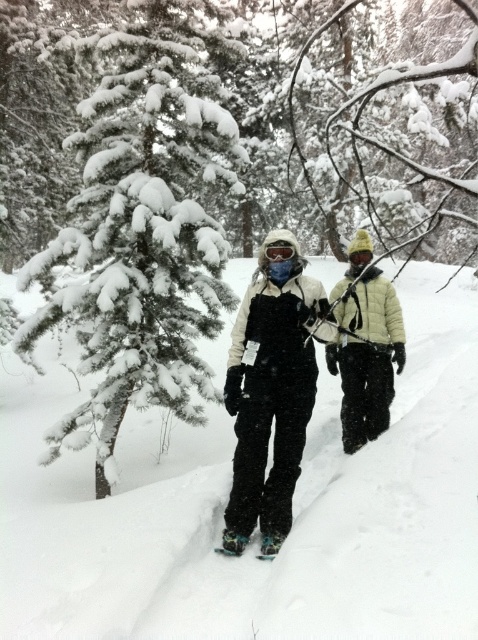
Who is taller, light yellow down jacket at center or blue rubber snowshoe at lower center?

Standing taller between the two is light yellow down jacket at center.

How distant is light yellow down jacket at center from blue rubber snowshoe at lower center?

light yellow down jacket at center is 2.17 meters away from blue rubber snowshoe at lower center.

Between point (362, 433) and point (269, 536), which one is positioned in front?

Point (269, 536)

The width and height of the screenshot is (478, 640). In order to click on light yellow down jacket at center in this screenshot , I will do `click(367, 356)`.

Is snow-covered pine tree at left to the right of blue rubber snowshoe at lower center from the viewer's perspective?

No, snow-covered pine tree at left is not to the right of blue rubber snowshoe at lower center.

Between snow-covered pine tree at left and blue rubber snowshoe at lower center, which one appears on the right side from the viewer's perspective?

blue rubber snowshoe at lower center is more to the right.

Who is more forward, (x=0, y=182) or (x=271, y=536)?

Point (x=271, y=536) is in front.

Locate an element on the screen. The height and width of the screenshot is (640, 478). snow-covered pine tree at left is located at coordinates (256, 122).

Is blue rubber snowshoe at lower center above green rubber snowshoe at center?

Indeed, blue rubber snowshoe at lower center is positioned over green rubber snowshoe at center.

Who is positioned more to the right, blue rubber snowshoe at lower center or green rubber snowshoe at center?

green rubber snowshoe at center is more to the right.

Between point (279, 538) and point (275, 538), which one is positioned in front?

Positioned in front is point (279, 538).

Where is `blue rubber snowshoe at lower center`? blue rubber snowshoe at lower center is located at coordinates (231, 544).